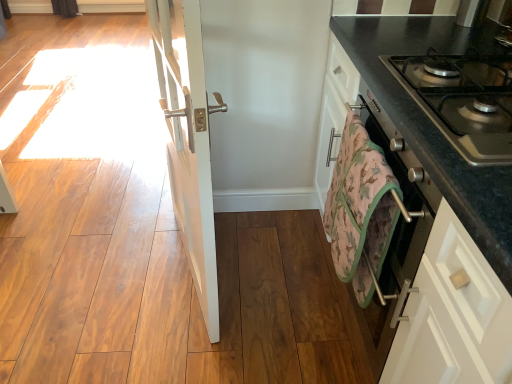
At what (x,y) coordinates should I click in order to perform the action: click on free spot in front of white glossy door at center. Please return your answer as a coordinate pair (x, y). The height and width of the screenshot is (384, 512). Looking at the image, I should click on (175, 334).